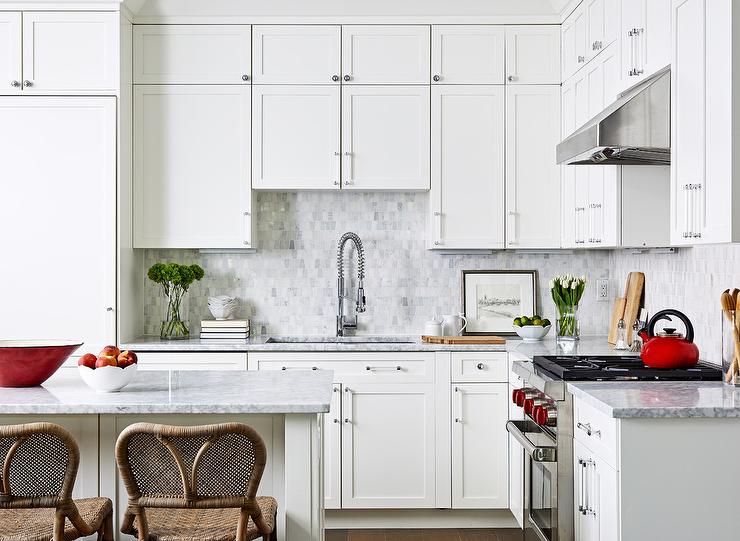
In order to click on chair in this screenshot , I will do `click(169, 467)`, `click(40, 458)`.